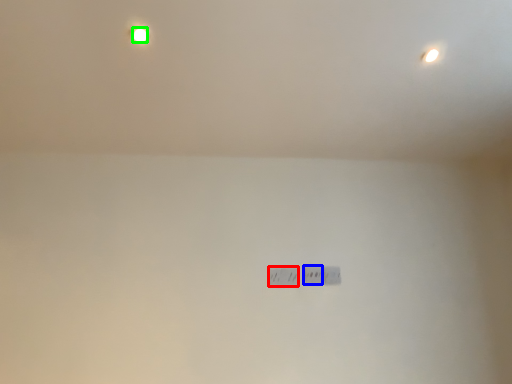
Question: Which object is positioned closest to power plugs and sockets (highlighted by a red box)? Select from power plugs and sockets (highlighted by a blue box) and light bulb (highlighted by a green box).

Choices:
 (A) power plugs and sockets
 (B) light bulb

Answer: (A)